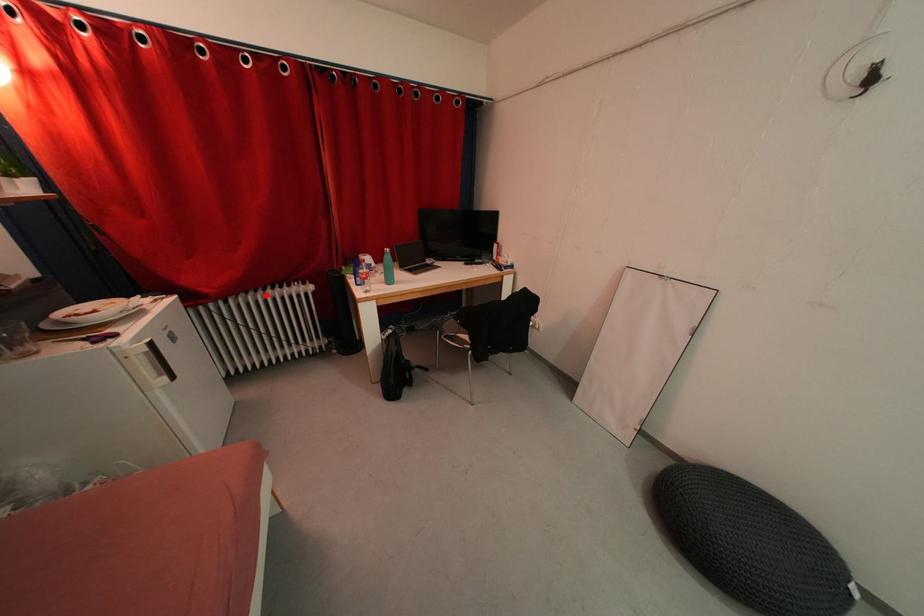
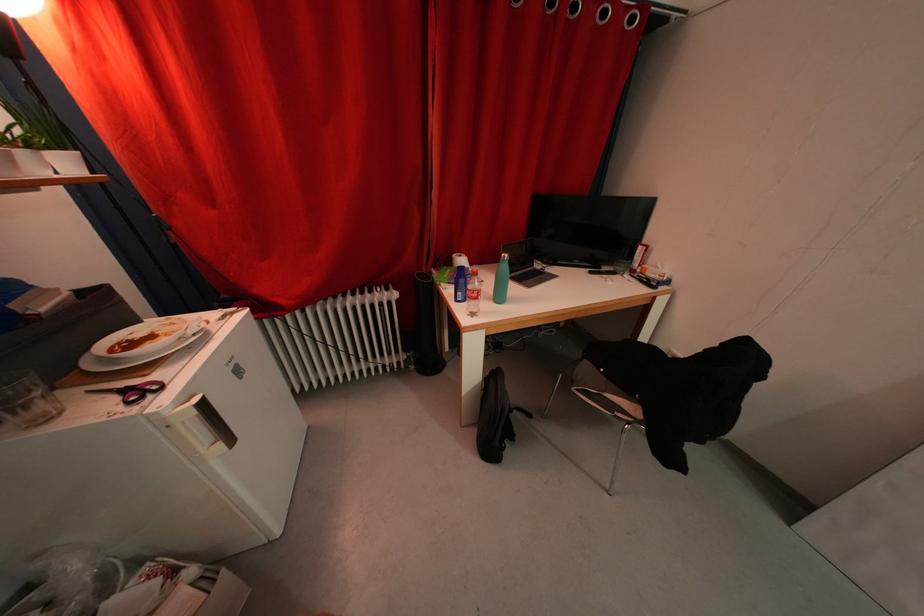
Question: I am providing you with two images of the same scene from different viewpoints. Given a red point in image1, look at the same physical point in image2. Is it:

Choices:
 (A) Closer to the viewpoint
 (B) Farther from the viewpoint

Answer: (B)